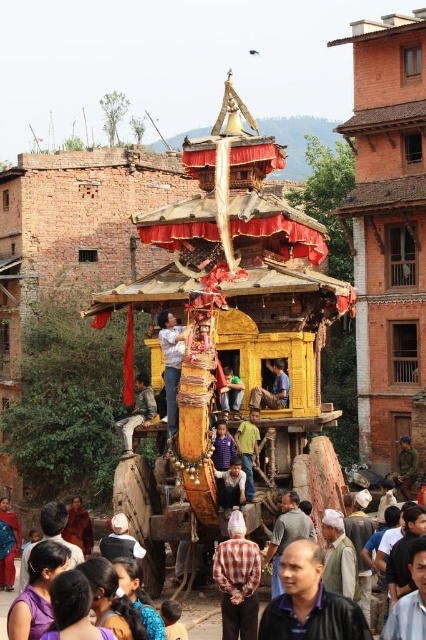
Between point (270, 584) and point (227, 493), which one is positioned behind?

The point (270, 584) is behind.

Is gray fabric shirt at center wider than light brown wooden person at center?

Yes, gray fabric shirt at center is wider than light brown wooden person at center.

Locate an element on the screen. The height and width of the screenshot is (640, 426). gray fabric shirt at center is located at coordinates (287, 536).

I want to click on gray fabric shirt at center, so click(x=287, y=536).

Is wooden bench at center shorter than blue fabric at center?

No.

The image size is (426, 640). What do you see at coordinates (138, 412) in the screenshot?
I see `wooden bench at center` at bounding box center [138, 412].

The width and height of the screenshot is (426, 640). I want to click on wooden bench at center, so click(138, 412).

Measure the distance between dark blue shirt at center and camera.

They are 24.90 meters apart.

Is dark blue shirt at center below checkered fabric shirt at center?

Incorrect, dark blue shirt at center is not positioned below checkered fabric shirt at center.

Between point (287, 554) and point (233, 528), which one is positioned in front?

Positioned in front is point (287, 554).

This screenshot has height=640, width=426. I want to click on dark blue shirt at center, so click(x=310, y=602).